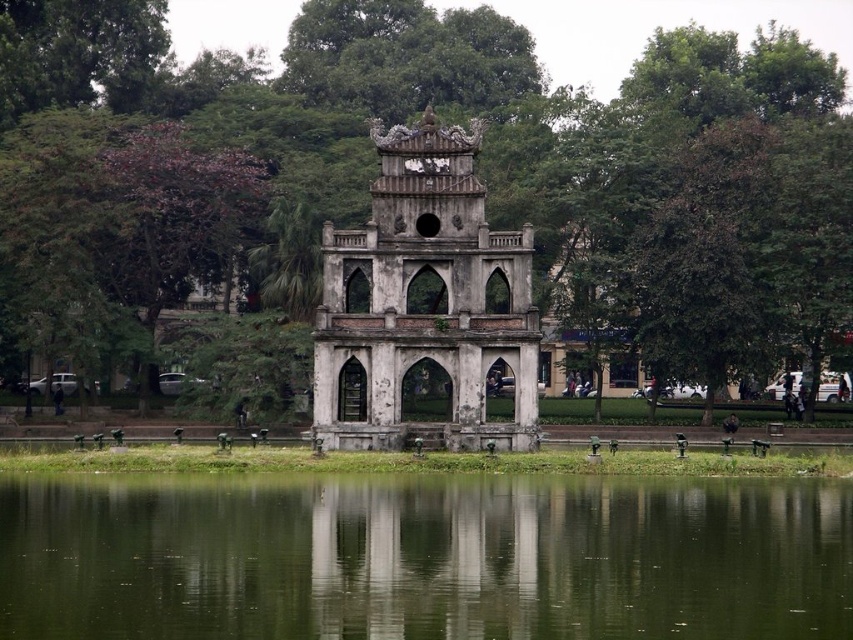
Question: Does green reflective water at center appear under white stone gazebo at center?

Choices:
 (A) yes
 (B) no

Answer: (A)

Question: Based on their relative distances, which object is farther from the green leafy tree at center?

Choices:
 (A) white stone gazebo at center
 (B) green reflective water at center

Answer: (B)

Question: In this image, where is green leafy tree at center located relative to white stone gazebo at center?

Choices:
 (A) left
 (B) right

Answer: (B)

Question: Considering the real-world distances, which object is closest to the white stone gazebo at center?

Choices:
 (A) green leafy tree at center
 (B) green reflective water at center

Answer: (A)

Question: Does green leafy tree at center have a lesser width compared to white stone gazebo at center?

Choices:
 (A) no
 (B) yes

Answer: (A)

Question: Estimate the real-world distances between objects in this image. Which object is farther from the green reflective water at center?

Choices:
 (A) green leafy tree at center
 (B) white stone gazebo at center

Answer: (A)